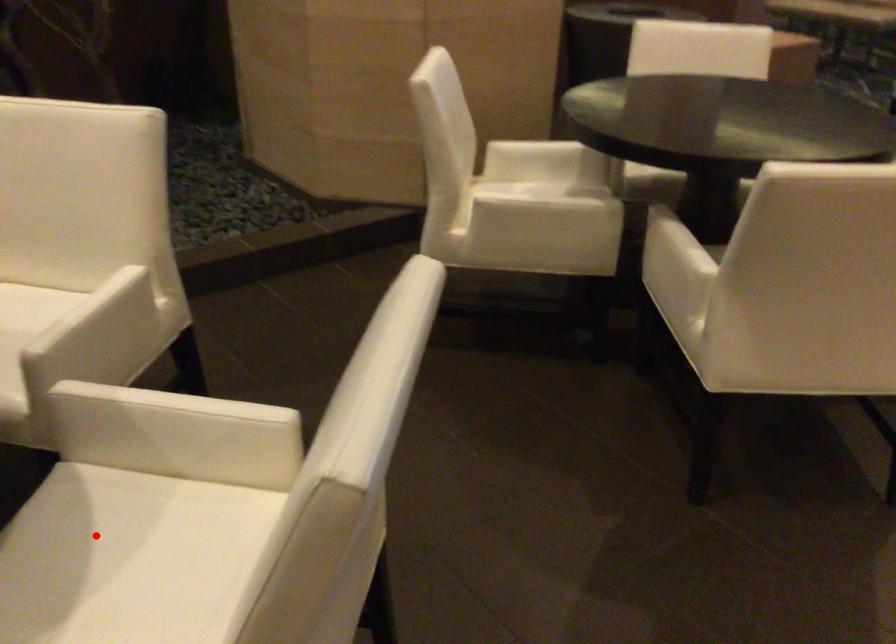
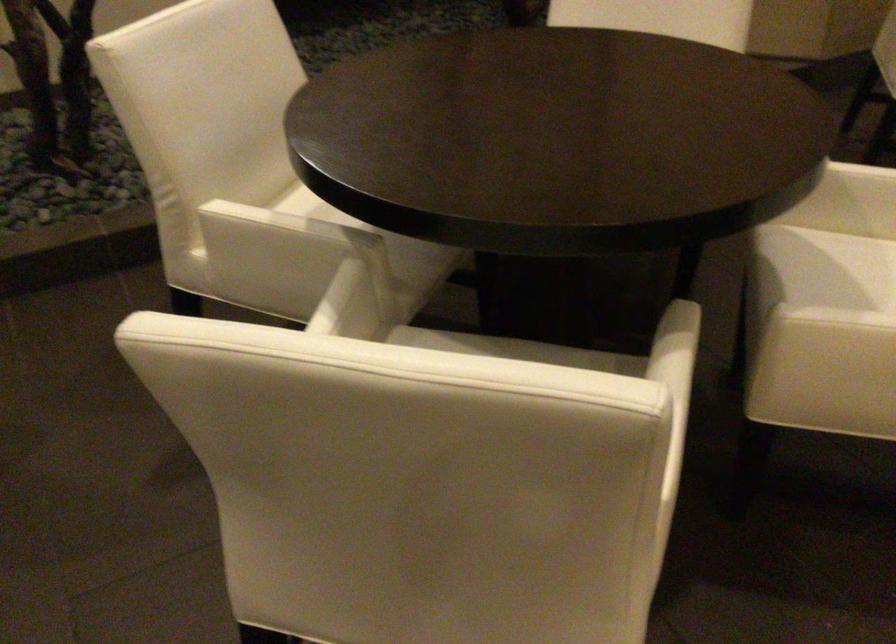
The point at the highlighted location is marked in the first image. Where is the corresponding point in the second image?

(855, 266)